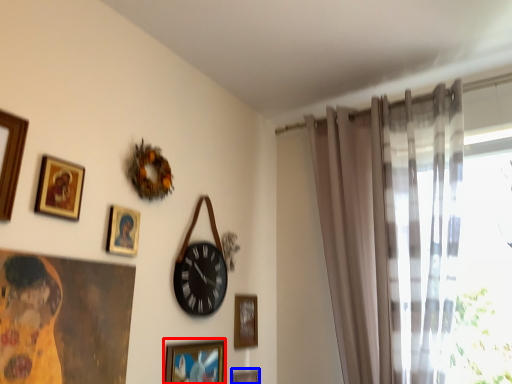
Question: Which object appears farthest to the camera in this image, picture frame (highlighted by a red box) or picture frame (highlighted by a blue box)?

Choices:
 (A) picture frame
 (B) picture frame

Answer: (B)